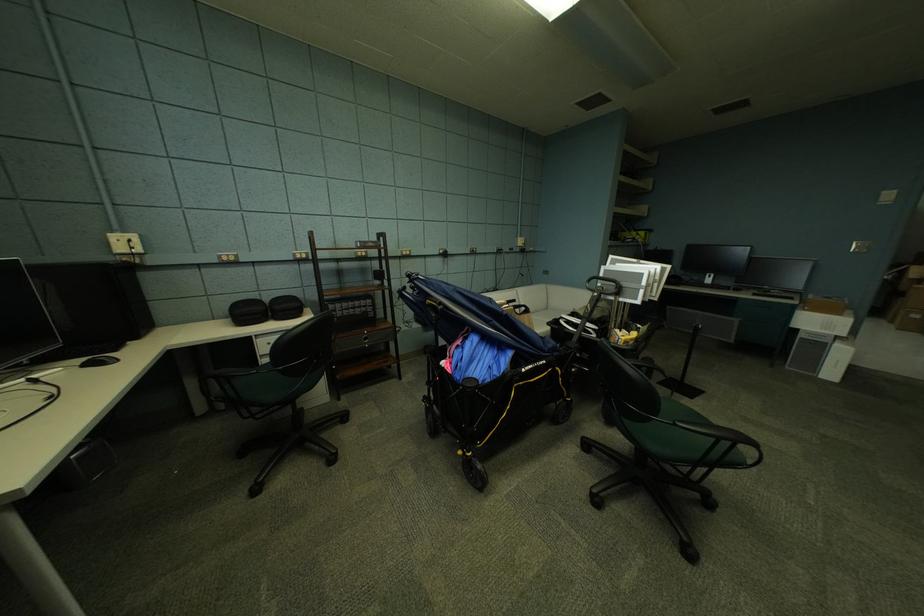
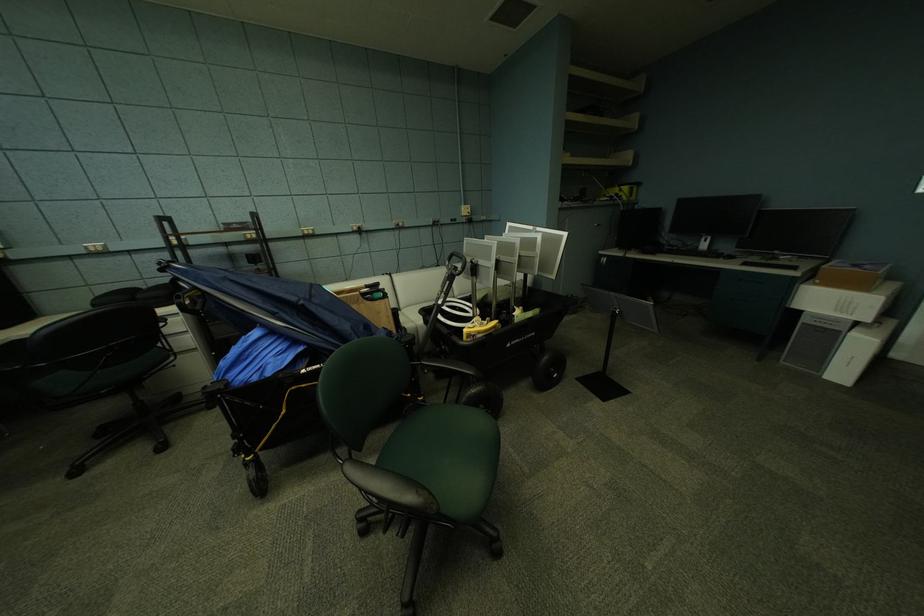
Question: In a continuous first-person perspective shot, in which direction is the camera moving?

Choices:
 (A) Left
 (B) Right
 (C) Forward
 (D) Backward

Answer: (B)